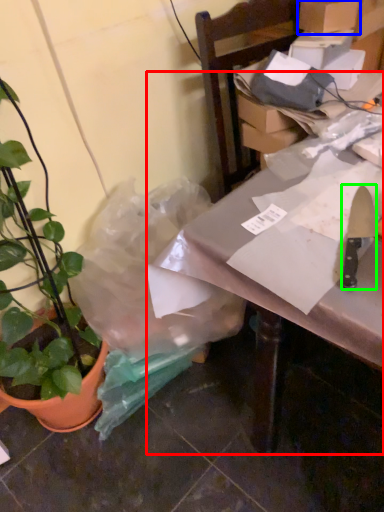
Question: Estimate the real-world distances between objects in this image. Which object is closer to table (highlighted by a red box), cardboard box (highlighted by a blue box) or kitchen knife (highlighted by a green box)?

Choices:
 (A) cardboard box
 (B) kitchen knife

Answer: (B)